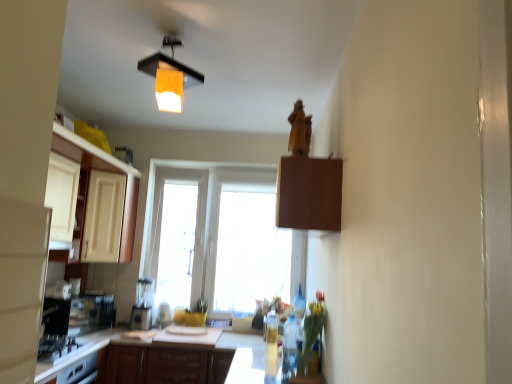
This screenshot has width=512, height=384. I want to click on free spot above wooden panel at upper center (from a real-world perspective), so click(x=170, y=34).